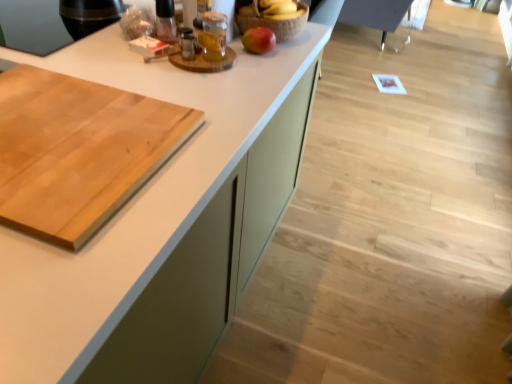
Identify the location of empty space that is to the right of red matte apple at upper center. (293, 53).